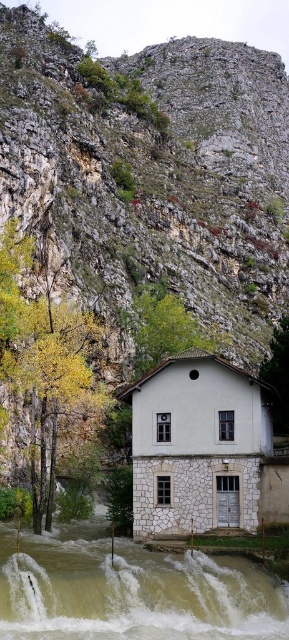
Consider the image. Can you confirm if brown stone river at lower center is thinner than green leafy tree at right?

Incorrect, brown stone river at lower center's width is not less than green leafy tree at right's.

Does brown stone river at lower center appear over green leafy tree at right?

Actually, brown stone river at lower center is below green leafy tree at right.

Locate an element on the screen. The image size is (289, 640). brown stone river at lower center is located at coordinates (130, 589).

Can you confirm if brown stone river at lower center is taller than green leafy tree at center?

No, brown stone river at lower center is not taller than green leafy tree at center.

Between brown stone river at lower center and green leafy tree at center, which one appears on the left side from the viewer's perspective?

brown stone river at lower center

Measure the distance between point (171, 605) and camera.

38.02 meters

Identify the location of brown stone river at lower center. The image size is (289, 640). (130, 589).

Which of these two, yellow-green leaves at left or green leafy tree at right, stands taller?

Standing taller between the two is yellow-green leaves at left.

Does yellow-green leaves at left lie in front of green leafy tree at right?

No, it is not.

Does point (19, 365) come closer to viewer compared to point (278, 353)?

That is False.

Find the location of a particular element. The height and width of the screenshot is (640, 289). yellow-green leaves at left is located at coordinates (43, 362).